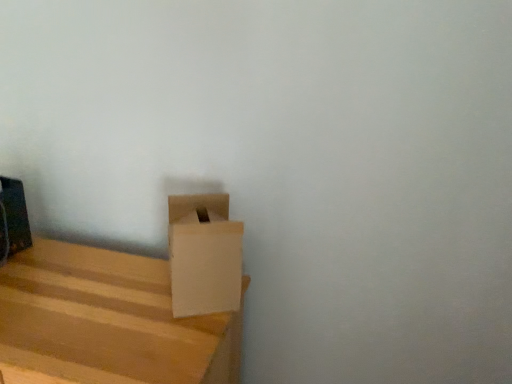
Question: Is point (115, 354) closer or farther from the camera than point (195, 243)?

Choices:
 (A) closer
 (B) farther

Answer: (A)

Question: From a real-world perspective, relative to white cardboard box at lower left, is light brown wood box at lower left vertically above or below?

Choices:
 (A) above
 (B) below

Answer: (B)

Question: Is light brown wood box at lower left inside or outside of white cardboard box at lower left?

Choices:
 (A) inside
 (B) outside

Answer: (B)

Question: Looking at their shapes, would you say white cardboard box at lower left is wider or thinner than light brown wood box at lower left?

Choices:
 (A) thin
 (B) wide

Answer: (A)

Question: Considering the positions of point (195, 297) and point (218, 372), is point (195, 297) closer or farther from the camera than point (218, 372)?

Choices:
 (A) farther
 (B) closer

Answer: (B)

Question: From a real-world perspective, is white cardboard box at lower left positioned above or below light brown wood box at lower left?

Choices:
 (A) below
 (B) above

Answer: (B)

Question: In the image, is white cardboard box at lower left positioned in front of or behind light brown wood box at lower left?

Choices:
 (A) behind
 (B) front

Answer: (A)